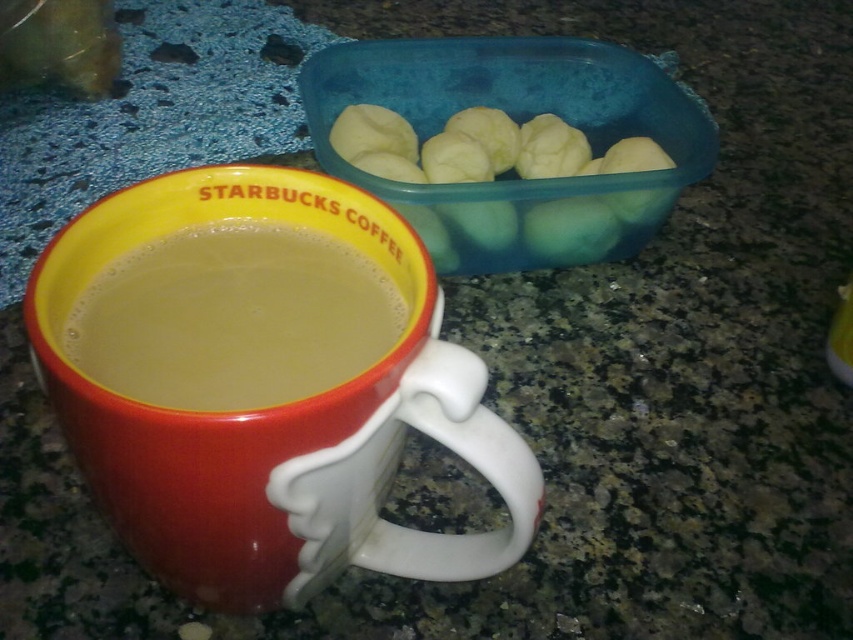
Based on the photo, how distant is matte ceramic mug at center from smooth white dough balls at upper right?

matte ceramic mug at center and smooth white dough balls at upper right are 17.14 inches apart from each other.

Is matte ceramic mug at center further to camera compared to smooth white dough balls at upper right?

No, matte ceramic mug at center is in front of smooth white dough balls at upper right.

Is point (347, 385) positioned after point (515, 125)?

No, (347, 385) is in front of (515, 125).

Locate an element on the screen. This screenshot has width=853, height=640. matte ceramic mug at center is located at coordinates (273, 420).

Is matte ceramic mug at lower left wider than smooth white dough balls at upper right?

No.

Does matte ceramic mug at lower left lie behind smooth white dough balls at upper right?

→ No.

This screenshot has width=853, height=640. What do you see at coordinates (233, 317) in the screenshot?
I see `matte ceramic mug at lower left` at bounding box center [233, 317].

I want to click on matte ceramic mug at lower left, so click(x=233, y=317).

Who is more forward, (347, 442) or (270, 330)?

Point (347, 442) is more forward.

Is matte ceramic mug at center positioned behind matte ceramic mug at lower left?

No, it is in front of matte ceramic mug at lower left.

Is point (90, 444) more distant than point (317, 388)?

Yes, it is behind point (317, 388).

Locate an element on the screen. The width and height of the screenshot is (853, 640). matte ceramic mug at center is located at coordinates [273, 420].